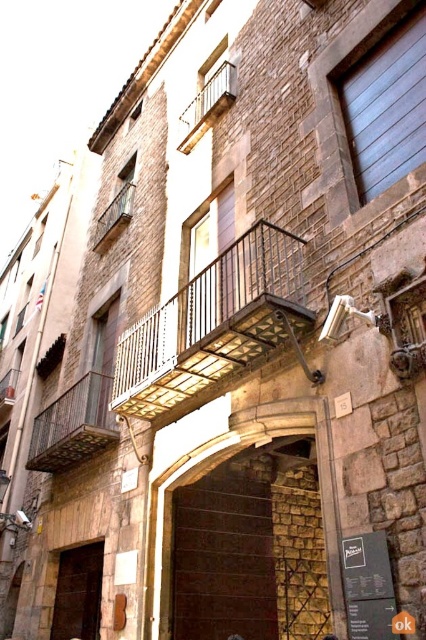
Question: Estimate the real-world distances between objects in this image. Which object is farther from the wooden at left?

Choices:
 (A) metallic wrought iron balcony at center
 (B) metallic silver balcony at upper center

Answer: (B)

Question: Considering the relative positions of metallic wrought iron balcony at center and rustic wood balcony at center in the image provided, where is metallic wrought iron balcony at center located with respect to rustic wood balcony at center?

Choices:
 (A) below
 (B) above

Answer: (A)

Question: Is metallic wrought iron balcony at center wider than rustic wood balcony at center?

Choices:
 (A) yes
 (B) no

Answer: (A)

Question: Can you confirm if wooden at left is positioned to the right of rustic wood balcony at center?

Choices:
 (A) yes
 (B) no

Answer: (B)

Question: Which object is closer to the camera taking this photo?

Choices:
 (A) metallic wrought iron balcony at center
 (B) rustic wood balcony at center
 (C) wooden at left

Answer: (A)

Question: Among these points, which one is farthest from the camera?

Choices:
 (A) (104, 220)
 (B) (210, 337)
 (C) (189, 108)
 (D) (98, 385)

Answer: (A)